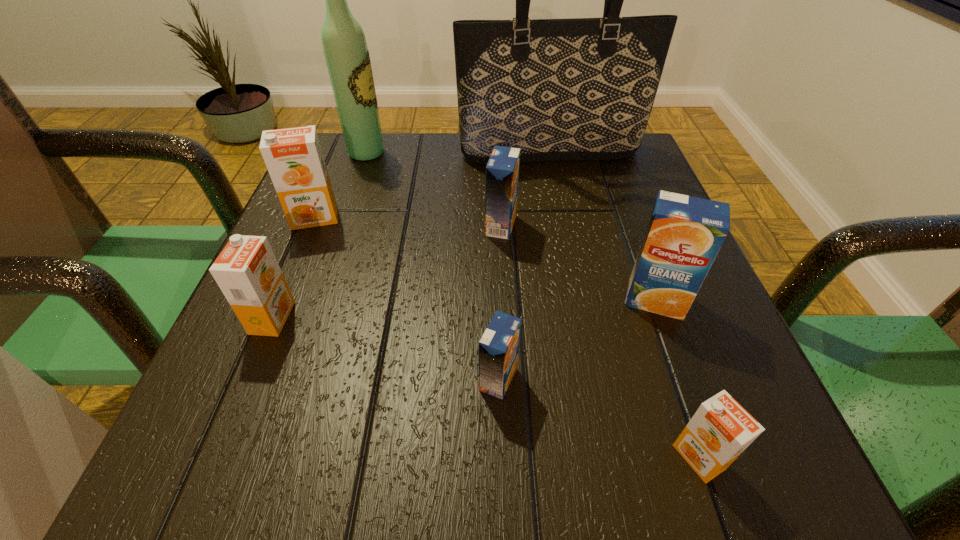
Identify the location of vacant region at the near edge of the desktop. This screenshot has height=540, width=960. (632, 433).

In the image, there is a desktop. In order to click on vacant space at the left edge in this screenshot , I will do `click(355, 247)`.

Locate an element on the screen. The height and width of the screenshot is (540, 960). free space at the right edge is located at coordinates (626, 221).

You are a GUI agent. You are given a task and a screenshot of the screen. Output one action in this format:
    pyautogui.click(x=<x>, y=<y>)
    Task: Click on the blank space at the far left corner of the desktop
    
    Given the screenshot: What is the action you would take?
    pyautogui.click(x=366, y=170)

In the image, there is a desktop. What are the coordinates of `vacant area at the near left corner` in the screenshot? It's located at (237, 442).

The image size is (960, 540). In the image, there is a desktop. In order to click on vacant space at the far right corner in this screenshot , I will do `click(607, 174)`.

This screenshot has width=960, height=540. What are the coordinates of `free space between the black tote bag and the white wine bottle` in the screenshot? It's located at (459, 153).

You are a GUI agent. You are given a task and a screenshot of the screen. Output one action in this format:
    pyautogui.click(x=<x>, y=<y>)
    Task: Click on the free space between the second tallest object and the second smallest orange orange juice
    
    Given the screenshot: What is the action you would take?
    pyautogui.click(x=320, y=235)

Image resolution: width=960 pixels, height=540 pixels. In order to click on vacant area that lies between the second tallest object and the second smallest blue orange_juice in this screenshot , I will do `click(434, 189)`.

Where is `empty space that is in between the second nearest orange juice and the farthest orange orange juice`? empty space that is in between the second nearest orange juice and the farthest orange orange juice is located at coordinates (407, 299).